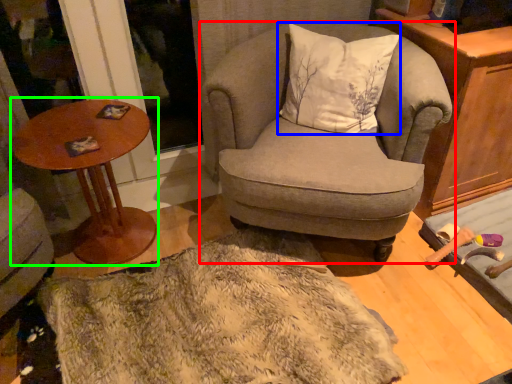
Question: Estimate the real-world distances between objects in this image. Which object is farther from chair (highlighted by a red box), pillow (highlighted by a blue box) or table (highlighted by a green box)?

Choices:
 (A) pillow
 (B) table

Answer: (B)